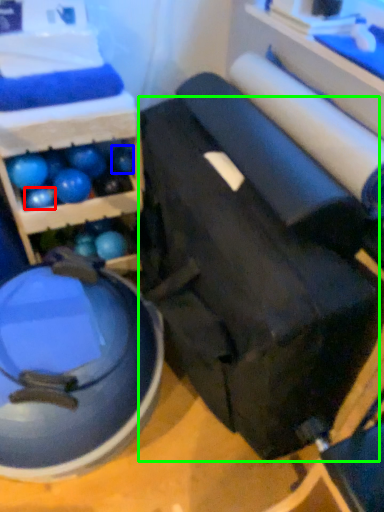
Question: Considering the real-world distances, which object is farthest from ball (highlighted by a red box)? ball (highlighted by a blue box) or swivel chair (highlighted by a green box)?

Choices:
 (A) ball
 (B) swivel chair

Answer: (B)